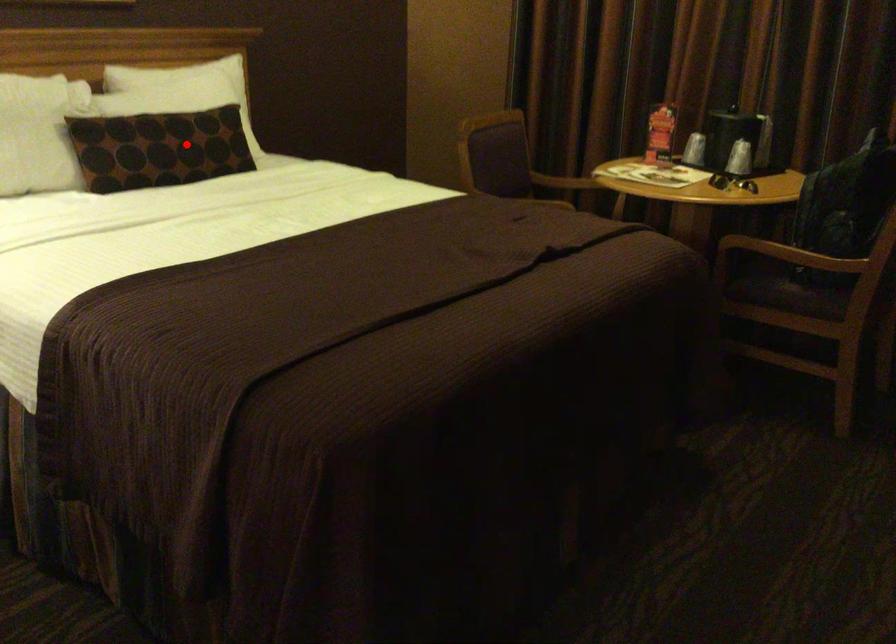
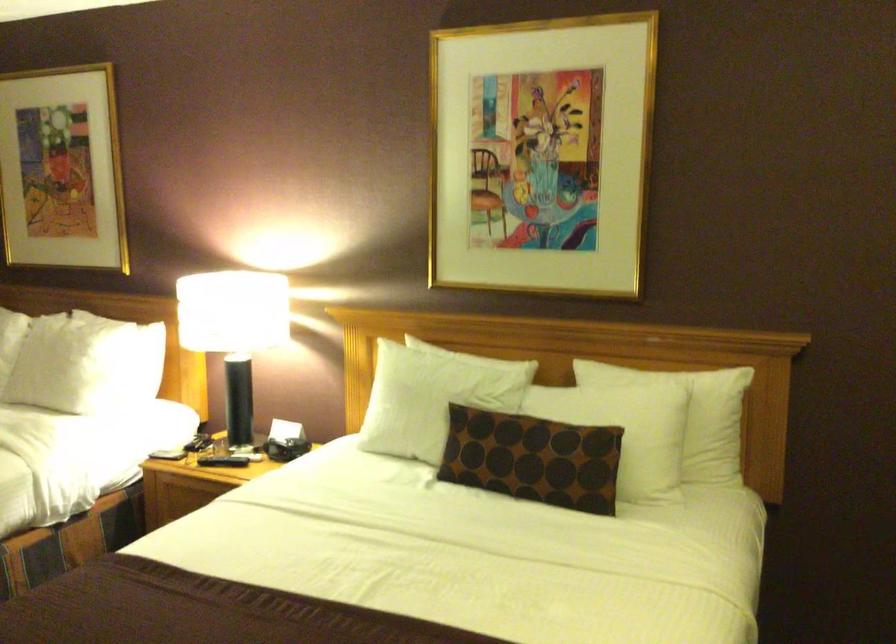
Question: I am providing you with two images of the same scene from different viewpoints. A red point is marked on the first image. Can you still see the location of the red point in image 2?

Choices:
 (A) Yes
 (B) No

Answer: (A)